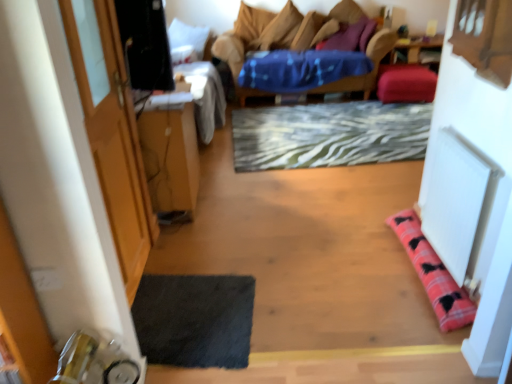
Where is `free space above dark gray textured yoga mat at lower left (from a real-world perspective)`? free space above dark gray textured yoga mat at lower left (from a real-world perspective) is located at coordinates (193, 311).